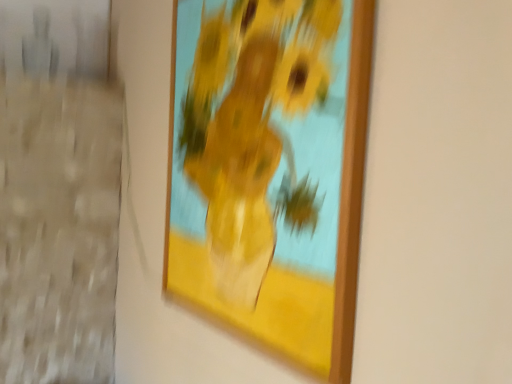
What is the approximate width of wooden picture frame at upper center?

2.12 inches.

Locate an element on the screen. This screenshot has height=384, width=512. wooden picture frame at upper center is located at coordinates (270, 169).

Describe the element at coordinates (270, 169) in the screenshot. I see `wooden picture frame at upper center` at that location.

This screenshot has width=512, height=384. Find the location of `wooden picture frame at upper center`. wooden picture frame at upper center is located at coordinates (270, 169).